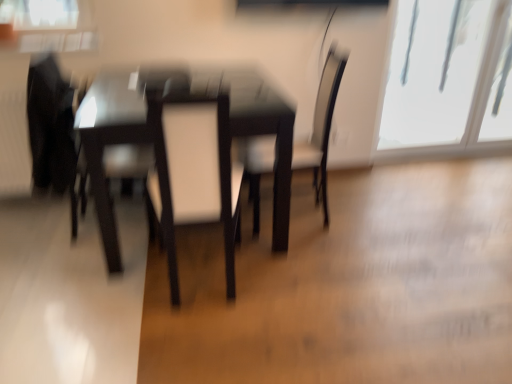
Question: Would you consider matte black swivel chair at left, which is the 1th swivel chair from left to right, to be distant from matte black chair at center?

Choices:
 (A) yes
 (B) no

Answer: (A)

Question: Is matte black swivel chair at left, acting as the second swivel chair starting from the right, bigger than matte black chair at center?

Choices:
 (A) no
 (B) yes

Answer: (A)

Question: Does matte black swivel chair at left, which is the 1th swivel chair from left to right, turn towards matte black chair at center?

Choices:
 (A) no
 (B) yes

Answer: (B)

Question: From the image's perspective, is matte black swivel chair at left, acting as the second swivel chair starting from the right, above matte black chair at center?

Choices:
 (A) yes
 (B) no

Answer: (A)

Question: Considering the relative sizes of matte black swivel chair at left, acting as the second swivel chair starting from the right, and matte black chair at center in the image provided, is matte black swivel chair at left, acting as the second swivel chair starting from the right, shorter than matte black chair at center?

Choices:
 (A) no
 (B) yes

Answer: (B)

Question: From the image's perspective, is matte black swivel chair at left, acting as the second swivel chair starting from the right, below matte black chair at center?

Choices:
 (A) no
 (B) yes

Answer: (A)

Question: Considering the relative sizes of transparent glass window at upper right and matte black swivel chair at left, acting as the second swivel chair starting from the right, in the image provided, is transparent glass window at upper right bigger than matte black swivel chair at left, acting as the second swivel chair starting from the right,?

Choices:
 (A) yes
 (B) no

Answer: (A)

Question: From a real-world perspective, does transparent glass window at upper right stand above matte black swivel chair at left, acting as the second swivel chair starting from the right?

Choices:
 (A) no
 (B) yes

Answer: (A)

Question: Does transparent glass window at upper right turn towards matte black swivel chair at left, acting as the second swivel chair starting from the right?

Choices:
 (A) no
 (B) yes

Answer: (A)

Question: Is transparent glass window at upper right beside matte black swivel chair at left, acting as the second swivel chair starting from the right?

Choices:
 (A) yes
 (B) no

Answer: (B)

Question: Does transparent glass window at upper right have a smaller size compared to matte black swivel chair at left, which is the 1th swivel chair from left to right?

Choices:
 (A) no
 (B) yes

Answer: (A)

Question: Would you say transparent glass window at upper right is outside matte black swivel chair at left, acting as the second swivel chair starting from the right?

Choices:
 (A) yes
 (B) no

Answer: (A)

Question: From a real-world perspective, is glossy dark wood table at center physically above transparent glass window at upper right?

Choices:
 (A) no
 (B) yes

Answer: (A)